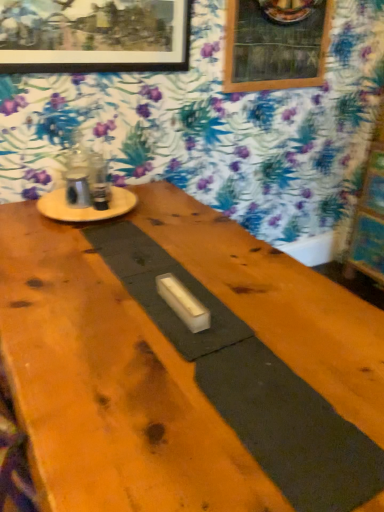
Question: Is the position of smooth wood table at center more distant than that of wooden bulletin board at right?

Choices:
 (A) no
 (B) yes

Answer: (A)

Question: Is smooth wood table at center to the left of wooden bulletin board at right from the viewer's perspective?

Choices:
 (A) no
 (B) yes

Answer: (B)

Question: Does smooth wood table at center have a larger size compared to wooden bulletin board at right?

Choices:
 (A) no
 (B) yes

Answer: (A)

Question: Considering the relative sizes of smooth wood table at center and wooden bulletin board at right in the image provided, is smooth wood table at center smaller than wooden bulletin board at right?

Choices:
 (A) no
 (B) yes

Answer: (B)

Question: Is smooth wood table at center closer to the viewer compared to wooden bulletin board at right?

Choices:
 (A) yes
 (B) no

Answer: (A)

Question: Considering the positions of smooth wood table at center and wooden picture frame at upper left, which is counted as the 1th picture frame, starting from the front, in the image, is smooth wood table at center taller or shorter than wooden picture frame at upper left, which is counted as the 1th picture frame, starting from the front,?

Choices:
 (A) tall
 (B) short

Answer: (B)

Question: From a real-world perspective, is smooth wood table at center above or below wooden picture frame at upper left, the first picture frame viewed from the left?

Choices:
 (A) above
 (B) below

Answer: (B)

Question: Looking at their shapes, would you say smooth wood table at center is wider or thinner than wooden picture frame at upper left, the 2th picture frame positioned from the back?

Choices:
 (A) wide
 (B) thin

Answer: (A)

Question: Would you say smooth wood table at center is inside or outside wooden picture frame at upper left, the 2th picture frame positioned from the back?

Choices:
 (A) inside
 (B) outside

Answer: (B)

Question: Is wooden round table at upper left inside the boundaries of wooden picture frame at upper left, the 2th picture frame positioned from the back, or outside?

Choices:
 (A) outside
 (B) inside

Answer: (A)

Question: Considering the positions of wooden round table at upper left and wooden picture frame at upper left, the 2th picture frame positioned from the back, in the image, is wooden round table at upper left taller or shorter than wooden picture frame at upper left, the 2th picture frame positioned from the back,?

Choices:
 (A) tall
 (B) short

Answer: (B)

Question: From the image's perspective, is wooden round table at upper left positioned above or below wooden picture frame at upper left, which is counted as the 1th picture frame, starting from the front?

Choices:
 (A) above
 (B) below

Answer: (B)

Question: From a real-world perspective, relative to wooden picture frame at upper left, the 2th picture frame positioned from the back, is wooden round table at upper left vertically above or below?

Choices:
 (A) below
 (B) above

Answer: (A)

Question: Based on their sizes in the image, would you say wooden round table at upper left is bigger or smaller than wooden picture frame at upper center, positioned as the first picture frame in back-to-front order?

Choices:
 (A) small
 (B) big

Answer: (A)

Question: Do you think wooden round table at upper left is within wooden picture frame at upper center, the 2th picture frame positioned from the front, or outside of it?

Choices:
 (A) outside
 (B) inside

Answer: (A)